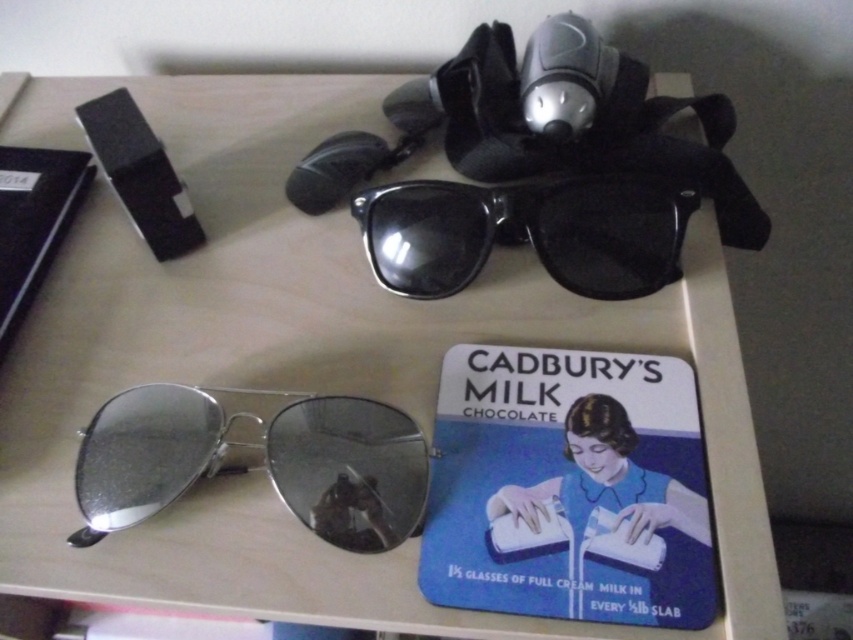
Can you confirm if silver reflective aviator sunglasses at bottom left is smaller than black plastic sunglasses at center?

Actually, silver reflective aviator sunglasses at bottom left might be larger than black plastic sunglasses at center.

Is point (163, 416) behind point (624, 204)?

No, (163, 416) is in front of (624, 204).

Which is behind, point (363, 444) or point (397, 282)?

Positioned behind is point (397, 282).

Identify the location of silver reflective aviator sunglasses at bottom left. The height and width of the screenshot is (640, 853). (264, 461).